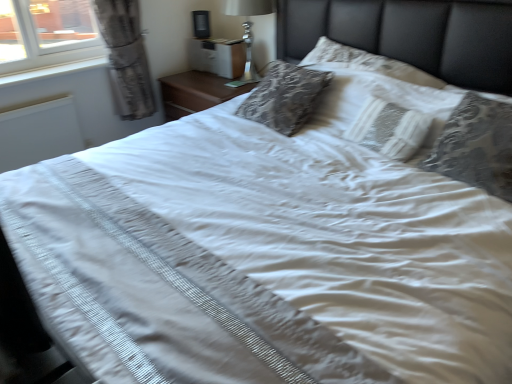
Question: Is white plastic window sill at left surrounded by white lace pillow at center, which ranks as the 1th pillow in left-to-right order?

Choices:
 (A) no
 (B) yes

Answer: (A)

Question: Considering the relative positions of white lace pillow at center, which ranks as the 1th pillow in left-to-right order, and white plastic window sill at left in the image provided, is white lace pillow at center, which ranks as the 1th pillow in left-to-right order, to the left of white plastic window sill at left from the viewer's perspective?

Choices:
 (A) no
 (B) yes

Answer: (A)

Question: Considering the relative sizes of white lace pillow at center, the 2th pillow viewed from the right, and white plastic window sill at left in the image provided, is white lace pillow at center, the 2th pillow viewed from the right, wider than white plastic window sill at left?

Choices:
 (A) yes
 (B) no

Answer: (B)

Question: Considering the relative sizes of white lace pillow at center, the 2th pillow viewed from the right, and white plastic window sill at left in the image provided, is white lace pillow at center, the 2th pillow viewed from the right, thinner than white plastic window sill at left?

Choices:
 (A) no
 (B) yes

Answer: (B)

Question: Is white lace pillow at center, the 2th pillow viewed from the right, outside white plastic window sill at left?

Choices:
 (A) no
 (B) yes

Answer: (B)

Question: Is white lace pillow at center, which ranks as the 1th pillow in left-to-right order, beside white plastic window sill at left?

Choices:
 (A) no
 (B) yes

Answer: (A)

Question: Does white plastic window sill at left have a smaller size compared to white lace pillow at center, the 2th pillow viewed from the right?

Choices:
 (A) yes
 (B) no

Answer: (A)

Question: Is white plastic window sill at left positioned before white lace pillow at center, the 2th pillow viewed from the right?

Choices:
 (A) yes
 (B) no

Answer: (B)

Question: From the image's perspective, is white plastic window sill at left on top of white lace pillow at center, the 2th pillow viewed from the right?

Choices:
 (A) yes
 (B) no

Answer: (A)

Question: Does white plastic window sill at left come behind white lace pillow at center, the 2th pillow viewed from the right?

Choices:
 (A) yes
 (B) no

Answer: (A)

Question: Is white lace pillow at center, the 2th pillow viewed from the right, located within white plastic window sill at left?

Choices:
 (A) yes
 (B) no

Answer: (B)

Question: Is white plastic window sill at left placed right next to white lace pillow at center, the 2th pillow viewed from the right?

Choices:
 (A) no
 (B) yes

Answer: (A)

Question: Is white matte radiator at left aimed at silver metallic lamp at upper center?

Choices:
 (A) no
 (B) yes

Answer: (A)